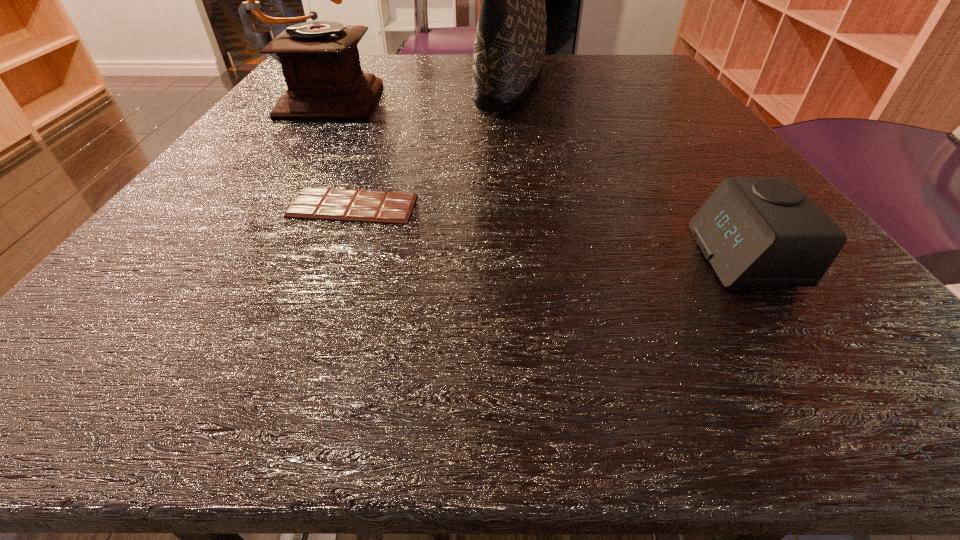
This screenshot has height=540, width=960. Identify the location of vacant space at the near edge of the desktop. (338, 347).

Identify the location of vacant point at the left edge. (272, 140).

This screenshot has height=540, width=960. I want to click on free space at the right edge of the desktop, so click(x=648, y=138).

In the image, there is a desktop. What are the coordinates of `vacant space at the far left corner` in the screenshot? It's located at (280, 87).

Find the location of `free space at the near left corner of the desktop`. free space at the near left corner of the desktop is located at coordinates (129, 359).

Locate an element on the screen. vacant space at the far right corner is located at coordinates (657, 90).

The image size is (960, 540). I want to click on vacant space at the near right corner of the desktop, so click(x=841, y=377).

Find the location of a particular element. This screenshot has width=960, height=540. empty space between the rightmost object and the second object from right to left is located at coordinates (627, 171).

This screenshot has height=540, width=960. I want to click on free space between the phonograph record and the third tallest object, so click(x=535, y=176).

This screenshot has height=540, width=960. In order to click on free space between the tallest object and the phonograph record in this screenshot , I will do `click(419, 90)`.